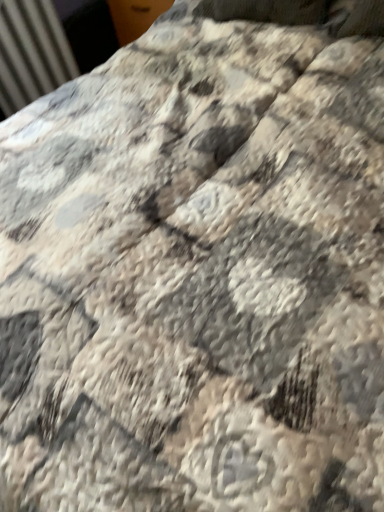
Question: Should I look upward or downward to see matte metal radiator at upper left?

Choices:
 (A) down
 (B) up

Answer: (B)